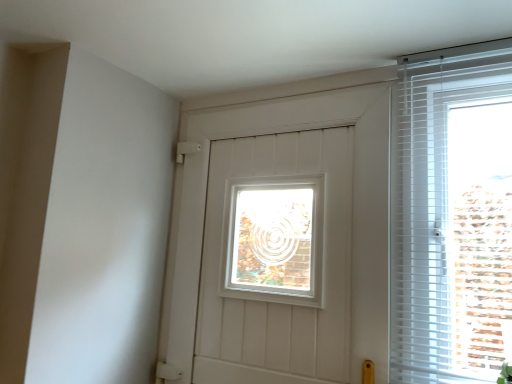
Question: Based on their sizes in the image, would you say white plastic blinds at right is bigger or smaller than white matte door at center?

Choices:
 (A) big
 (B) small

Answer: (B)

Question: From the image's perspective, relative to white matte door at center, is white plastic blinds at right above or below?

Choices:
 (A) below
 (B) above

Answer: (B)

Question: Is white plastic blinds at right taller or shorter than white matte door at center?

Choices:
 (A) short
 (B) tall

Answer: (A)

Question: Is white matte door at center spatially inside white plastic blinds at right, or outside of it?

Choices:
 (A) inside
 (B) outside

Answer: (B)

Question: Is point (364, 183) closer or farther from the camera than point (395, 332)?

Choices:
 (A) farther
 (B) closer

Answer: (A)

Question: Is white matte door at center wider or thinner than white plastic blinds at right?

Choices:
 (A) wide
 (B) thin

Answer: (A)

Question: From a real-world perspective, is white matte door at center physically located above or below white plastic blinds at right?

Choices:
 (A) above
 (B) below

Answer: (B)